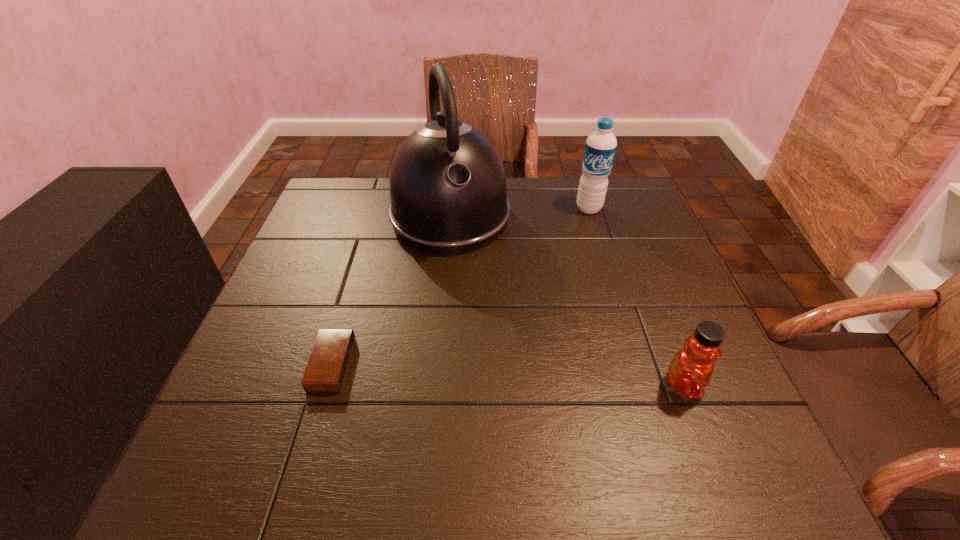
Image resolution: width=960 pixels, height=540 pixels. I want to click on free space that is in between the honey and the second tallest object, so click(636, 297).

Image resolution: width=960 pixels, height=540 pixels. I want to click on object that is the second closest to the third object from right to left, so click(328, 363).

Choose which object is the second nearest neighbor to the second object from right to left. Please provide its 2D coordinates. Your answer should be formatted as a tuple, i.e. [(x, y)], where the tuple contains the x and y coordinates of a point satisfying the conditions above.

[(690, 371)]